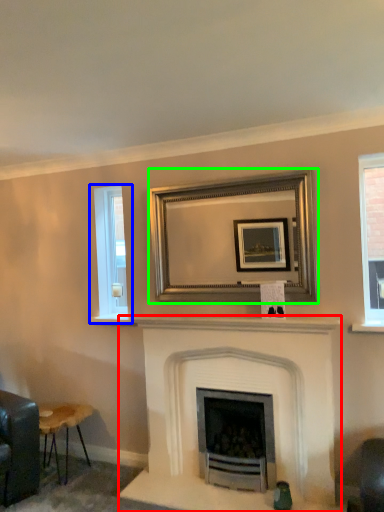
Question: Which is nearer to the fireplace (highlighted by a red box)? window (highlighted by a blue box) or picture frame (highlighted by a green box).

Choices:
 (A) window
 (B) picture frame

Answer: (B)